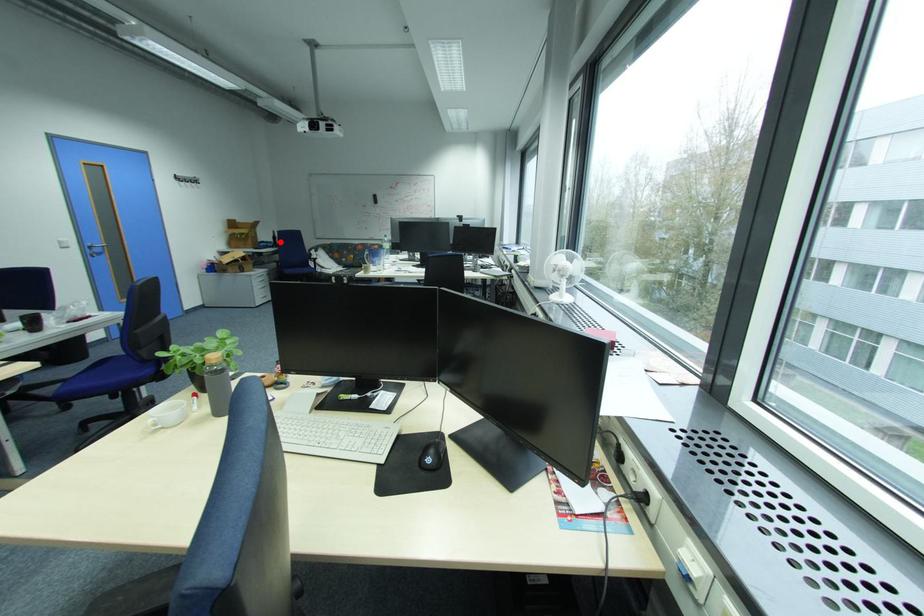
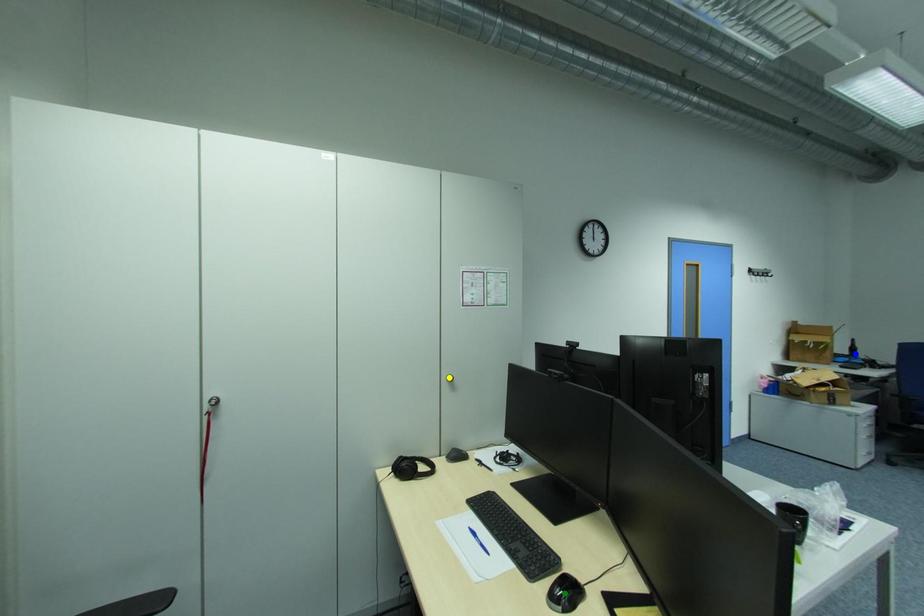
Question: I am providing you with two images of the same scene from different viewpoints. A red point is marked on the first image. You are given multiple points on the second image. Can you choose the point in image 2 that corresponds to the point in image 1?

Choices:
 (A) yellow point
 (B) blue point
 (C) green point

Answer: (B)